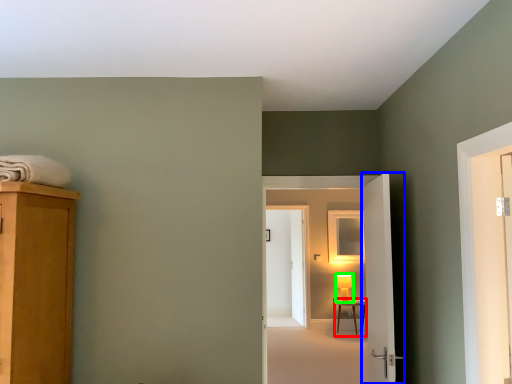
Question: Estimate the real-world distances between objects in this image. Which object is closer to table (highlighted by a red box), door (highlighted by a blue box) or table lamp (highlighted by a green box)?

Choices:
 (A) door
 (B) table lamp

Answer: (B)